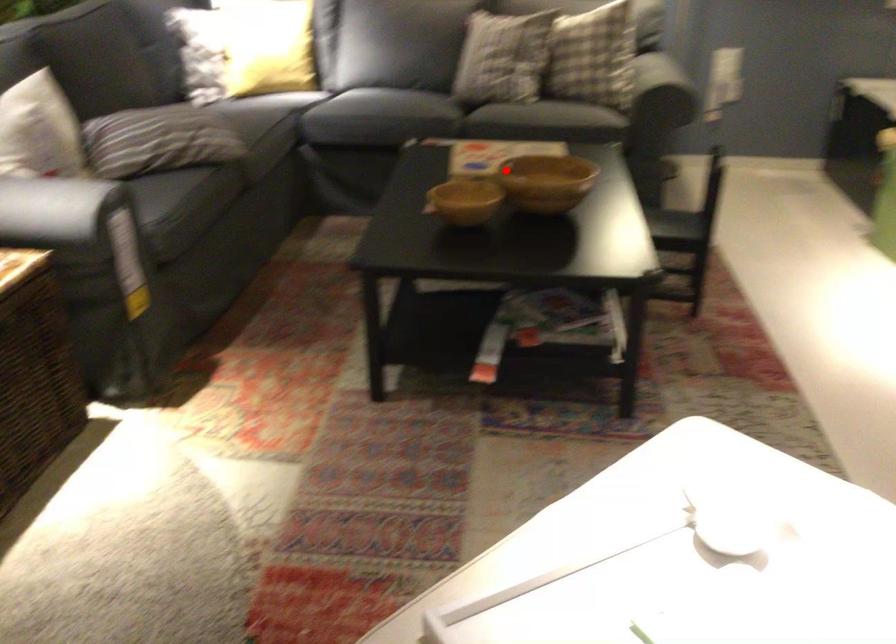
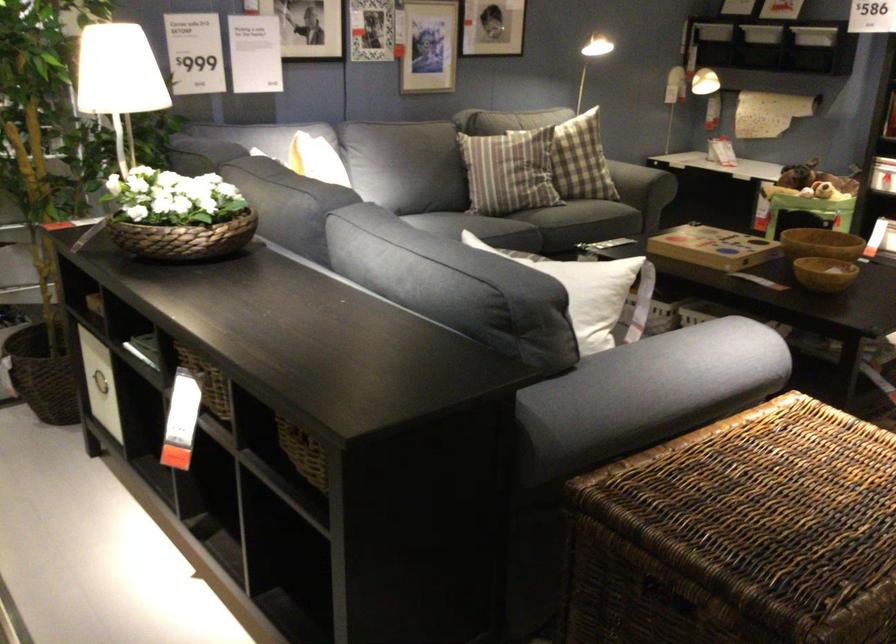
Question: A red point is marked in image1. In image2, is the corresponding 3D point closer to the camera or farther? Reply with the corresponding letter.

Choices:
 (A) The corresponding 3D point is closer.
 (B) The corresponding 3D point is farther.

Answer: (B)